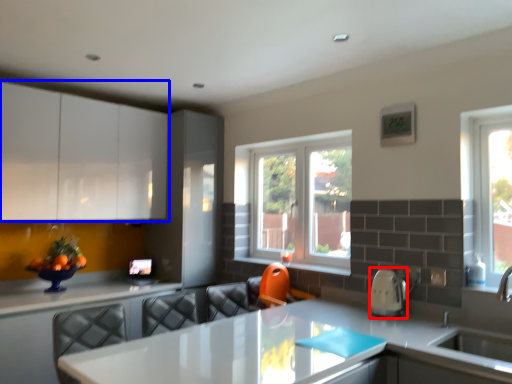
Question: Which of the following is the closest to the observer, appliance (highlighted by a red box) or cabinetry (highlighted by a blue box)?

Choices:
 (A) appliance
 (B) cabinetry

Answer: (A)